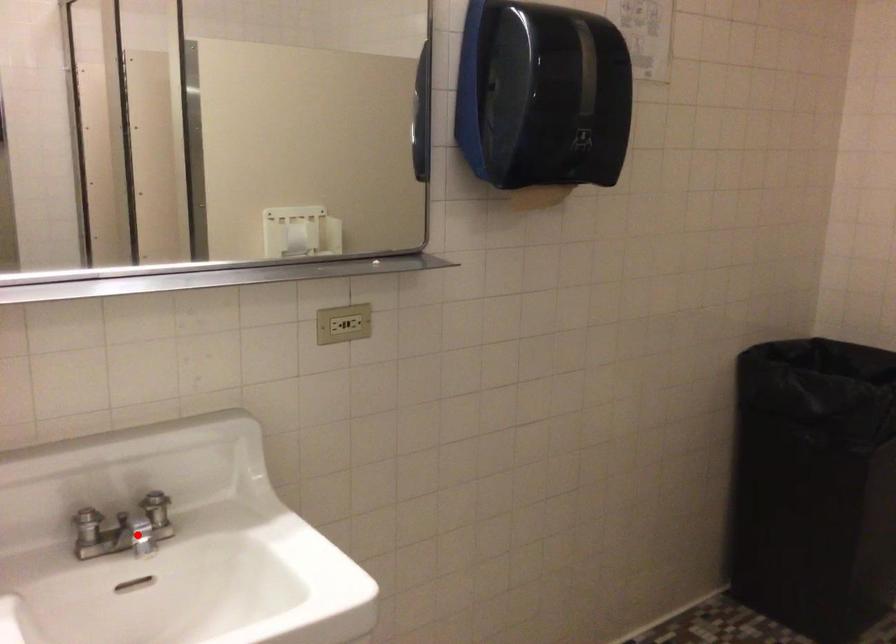
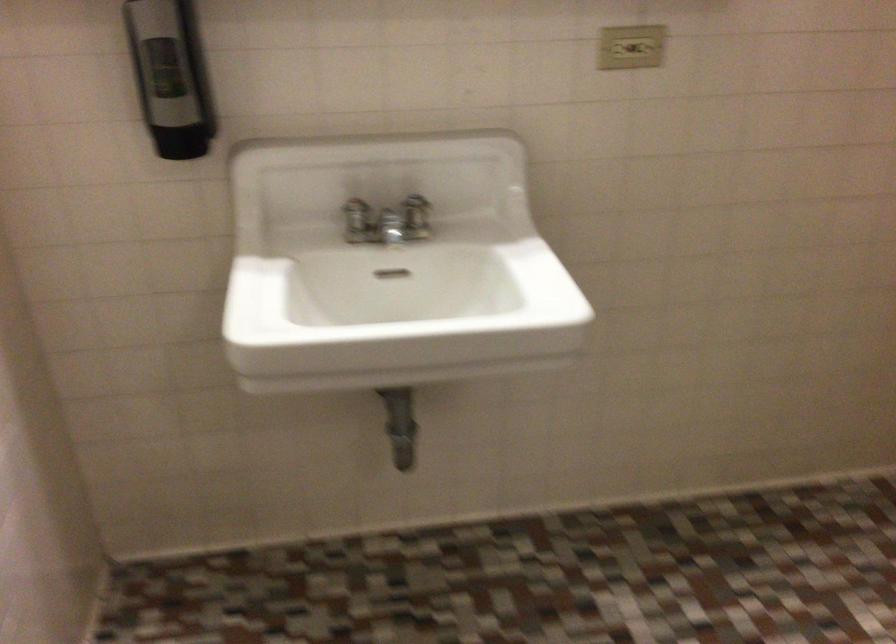
The point at the highlighted location is marked in the first image. Where is the corresponding point in the second image?

(391, 225)